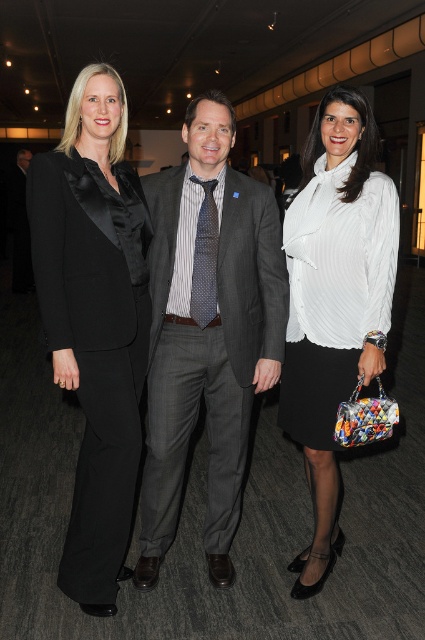
You are a photographer setting up for a group photo. You need to ensure that all clothing items from the two people at the center are visible. Given that the white pleated blouse at center and the polka dot silk tie at center are the focal points, which clothing item should you focus on to capture the widest part of their attire?

The white pleated blouse at center should be focused on since it is wider than the polka dot silk tie at center, making it the wider of the two clothing items.